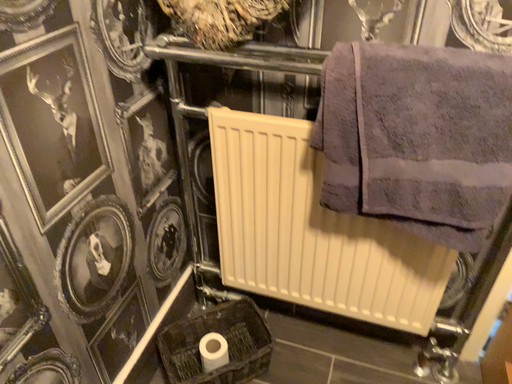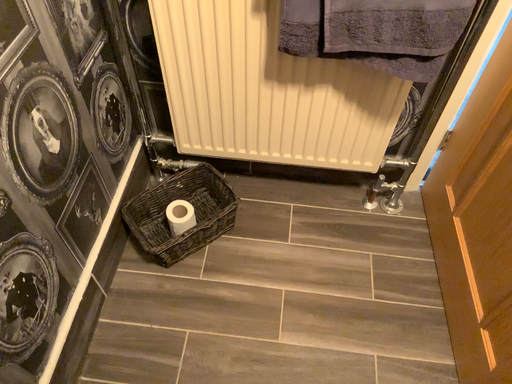
Question: Which way did the camera rotate in the video?

Choices:
 (A) rotated upward
 (B) rotated downward

Answer: (B)